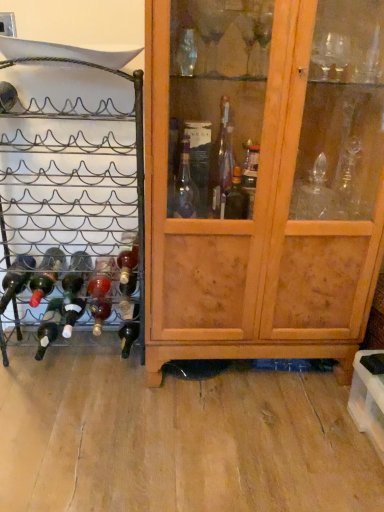
The width and height of the screenshot is (384, 512). In order to click on free space in front of matte dark brown bottle at lower left, the second bottle when ordered from left to right in this screenshot , I will do `click(44, 379)`.